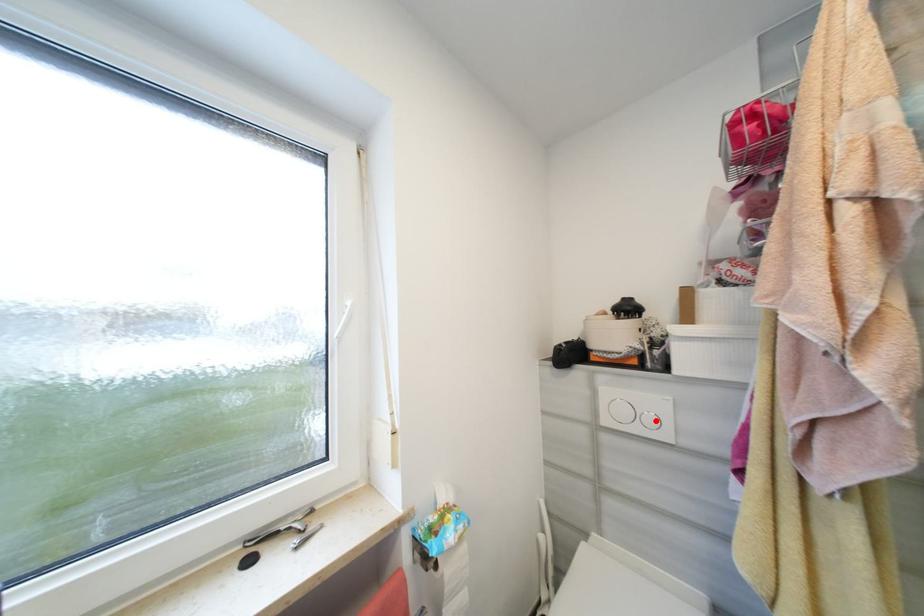
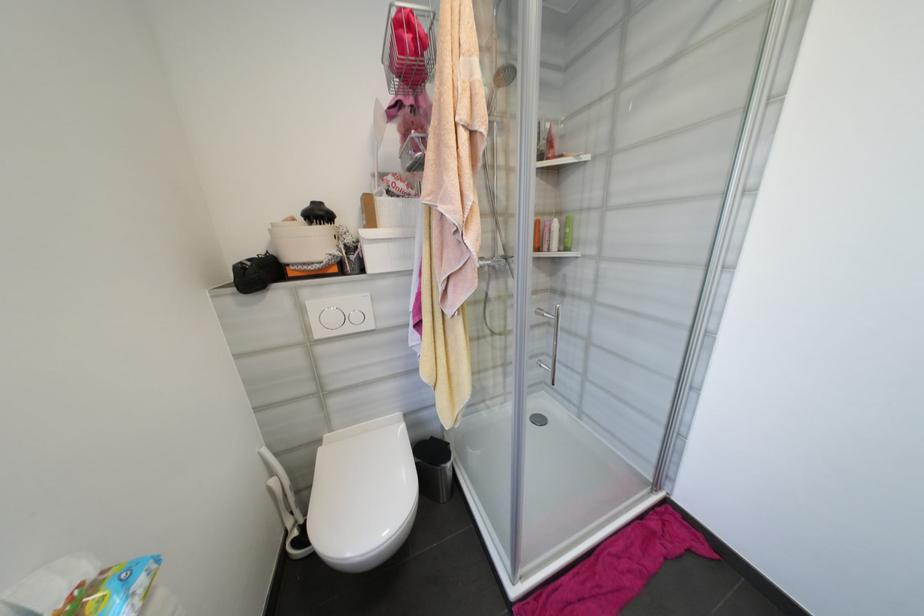
Locate, in the second image, the point that corresponds to the highlighted location in the first image.

(361, 318)